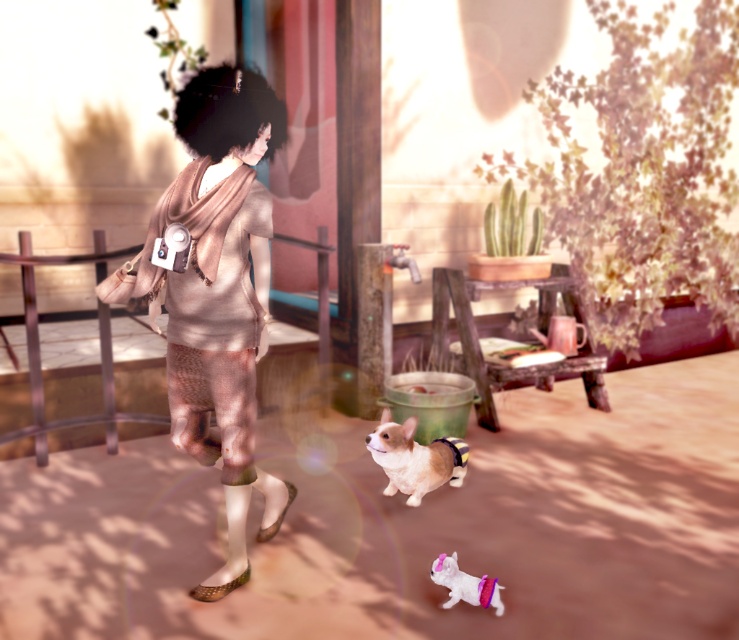
Is point (389, 445) less distant than point (449, 593)?

No, (389, 445) is further to viewer.

Locate an element on the screen. This screenshot has height=640, width=739. soft beige fur at center is located at coordinates (415, 458).

Is matte beige dress at center smaller than soft beige fur at center?

Actually, matte beige dress at center might be larger than soft beige fur at center.

Locate an element on the screen. The height and width of the screenshot is (640, 739). matte beige dress at center is located at coordinates (217, 292).

Is matte beige dress at center wider than white fabric dog at lower center?

Yes.

Who is higher up, matte beige dress at center or white fabric dog at lower center?

matte beige dress at center

Is point (221, 118) closer to camera compared to point (474, 586)?

That is True.

At what (x,y) coordinates should I click in order to perform the action: click on matte beige dress at center. Please return your answer as a coordinate pair (x, y). This screenshot has width=739, height=640. Looking at the image, I should click on (217, 292).